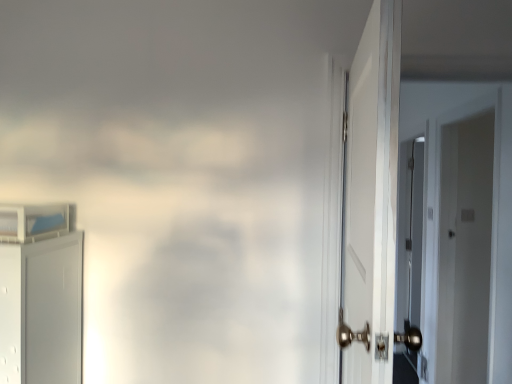
Describe the element at coordinates (42, 311) in the screenshot. The height and width of the screenshot is (384, 512). I see `white matte cabinet at left, the second door from the right` at that location.

This screenshot has height=384, width=512. What are the coordinates of `white matte cabinet at left, the 1th door positioned from the left` in the screenshot? It's located at (42, 311).

The width and height of the screenshot is (512, 384). What are the coordinates of `white glossy door at right, which ranks as the 2th door in left-to-right order` in the screenshot? It's located at (458, 229).

Describe the element at coordinates (458, 229) in the screenshot. I see `white glossy door at right, the first door positioned from the right` at that location.

In order to click on white matte cabinet at left, the second door from the right in this screenshot , I will do `click(42, 311)`.

Considering the positions of objects white matte cabinet at left, the second door from the right, and white glossy door at right, which ranks as the 2th door in left-to-right order, in the image provided, who is more to the right, white matte cabinet at left, the second door from the right, or white glossy door at right, which ranks as the 2th door in left-to-right order,?

From the viewer's perspective, white glossy door at right, which ranks as the 2th door in left-to-right order, appears more on the right side.

Is white matte cabinet at left, the 1th door positioned from the left, positioned before white glossy door at right, the first door positioned from the right?

Yes, white matte cabinet at left, the 1th door positioned from the left, is in front of white glossy door at right, the first door positioned from the right.

Is point (35, 368) positioned after point (445, 365)?

No, it is not.

From the image's perspective, does white matte cabinet at left, the second door from the right, appear higher than white glossy door at right, which ranks as the 2th door in left-to-right order?

No.

From a real-world perspective, between white matte cabinet at left, the 1th door positioned from the left, and white glossy door at right, the first door positioned from the right, who is vertically higher?

white glossy door at right, the first door positioned from the right, from a real-world perspective.

Can you confirm if white matte cabinet at left, the 1th door positioned from the left, is wider than white glossy door at right, which ranks as the 2th door in left-to-right order?

Indeed, white matte cabinet at left, the 1th door positioned from the left, has a greater width compared to white glossy door at right, which ranks as the 2th door in left-to-right order.

Considering the sizes of objects white matte cabinet at left, the second door from the right, and white glossy door at right, the first door positioned from the right, in the image provided, who is shorter, white matte cabinet at left, the second door from the right, or white glossy door at right, the first door positioned from the right,?

With less height is white matte cabinet at left, the second door from the right.

Who is smaller, white matte cabinet at left, the 1th door positioned from the left, or white glossy door at right, the first door positioned from the right?

Smaller between the two is white matte cabinet at left, the 1th door positioned from the left.

Is white matte cabinet at left, the 1th door positioned from the left, outside of white glossy door at right, which ranks as the 2th door in left-to-right order?

That's correct, white matte cabinet at left, the 1th door positioned from the left, is outside of white glossy door at right, which ranks as the 2th door in left-to-right order.

Is white matte cabinet at left, the second door from the right, beside white glossy door at right, which ranks as the 2th door in left-to-right order?

No, white matte cabinet at left, the second door from the right, is not making contact with white glossy door at right, which ranks as the 2th door in left-to-right order.

Is white matte cabinet at left, the second door from the right, oriented towards white glossy door at right, the first door positioned from the right?

Yes, white matte cabinet at left, the second door from the right, is turned towards white glossy door at right, the first door positioned from the right.

Looking at this image, how different are the orientations of white matte cabinet at left, the second door from the right, and white glossy door at right, the first door positioned from the right, in degrees?

The facing directions of white matte cabinet at left, the second door from the right, and white glossy door at right, the first door positioned from the right, are 89.2 degrees apart.

This screenshot has height=384, width=512. Identify the location of door located underneath the white glossy door at right, the first door positioned from the right (from a real-world perspective). (42, 311).

Is white glossy door at right, the first door positioned from the right, at the right side of white matte cabinet at left, the second door from the right?

Yes.

Is white glossy door at right, which ranks as the 2th door in left-to-right order, closer to camera compared to white matte cabinet at left, the 1th door positioned from the left?

No, white glossy door at right, which ranks as the 2th door in left-to-right order, is further to the viewer.

Is point (503, 103) farther from camera compared to point (14, 375)?

That is True.

From the image's perspective, is white glossy door at right, the first door positioned from the right, positioned above or below white matte cabinet at left, the second door from the right?

white glossy door at right, the first door positioned from the right, is situated higher than white matte cabinet at left, the second door from the right, in the image.

From a real-world perspective, which is physically above, white glossy door at right, which ranks as the 2th door in left-to-right order, or white matte cabinet at left, the 1th door positioned from the left?

white glossy door at right, which ranks as the 2th door in left-to-right order, from a real-world perspective.

Is white glossy door at right, which ranks as the 2th door in left-to-right order, thinner than white matte cabinet at left, the second door from the right?

Correct, the width of white glossy door at right, which ranks as the 2th door in left-to-right order, is less than that of white matte cabinet at left, the second door from the right.

Considering the relative sizes of white glossy door at right, the first door positioned from the right, and white matte cabinet at left, the second door from the right, in the image provided, is white glossy door at right, the first door positioned from the right, shorter than white matte cabinet at left, the second door from the right,?

Incorrect, the height of white glossy door at right, the first door positioned from the right, does not fall short of that of white matte cabinet at left, the second door from the right.

Consider the image. Who is smaller, white glossy door at right, which ranks as the 2th door in left-to-right order, or white matte cabinet at left, the second door from the right?

With smaller size is white matte cabinet at left, the second door from the right.

In the scene shown: Choose the correct answer: Is white glossy door at right, which ranks as the 2th door in left-to-right order, inside white matte cabinet at left, the second door from the right, or outside it?

The correct answer is: outside.

Is white glossy door at right, which ranks as the 2th door in left-to-right order, beside white matte cabinet at left, the 1th door positioned from the left?

white glossy door at right, which ranks as the 2th door in left-to-right order, and white matte cabinet at left, the 1th door positioned from the left, are clearly separated.

Is white matte cabinet at left, the 1th door positioned from the left, at the back of white glossy door at right, which ranks as the 2th door in left-to-right order?

No.

How different are the orientations of white glossy door at right, the first door positioned from the right, and white matte cabinet at left, the 1th door positioned from the left, in degrees?

89.2 degrees separate the facing orientations of white glossy door at right, the first door positioned from the right, and white matte cabinet at left, the 1th door positioned from the left.

You are a GUI agent. You are given a task and a screenshot of the screen. Output one action in this format:
    pyautogui.click(x=<x>, y=<y>)
    Task: Click on the door on the right of white matte cabinet at left, the 1th door positioned from the left
    
    Given the screenshot: What is the action you would take?
    pyautogui.click(x=458, y=229)

You are a GUI agent. You are given a task and a screenshot of the screen. Output one action in this format:
    pyautogui.click(x=<x>, y=<y>)
    Task: Click on the door above the white matte cabinet at left, the 1th door positioned from the left (from the image's perspective)
    
    Given the screenshot: What is the action you would take?
    pyautogui.click(x=458, y=229)

The width and height of the screenshot is (512, 384). What are the coordinates of `door that appears in front of the white glossy door at right, which ranks as the 2th door in left-to-right order` in the screenshot? It's located at (42, 311).